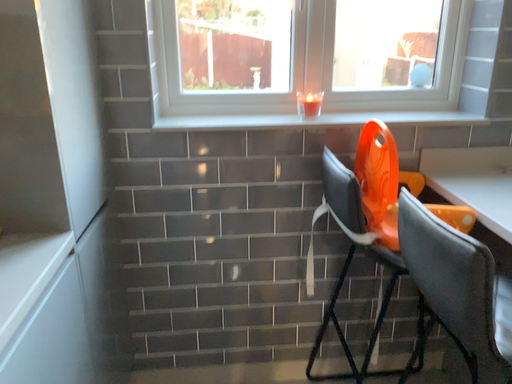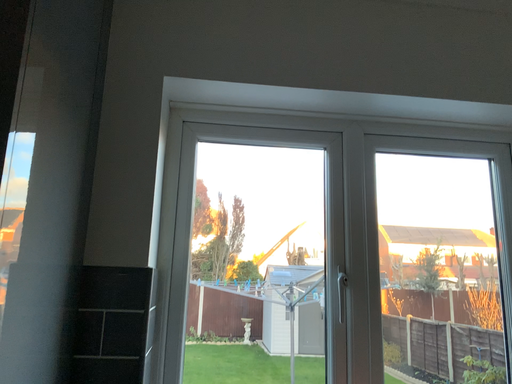
Question: Which way did the camera rotate in the video?

Choices:
 (A) rotated downward
 (B) rotated upward

Answer: (B)